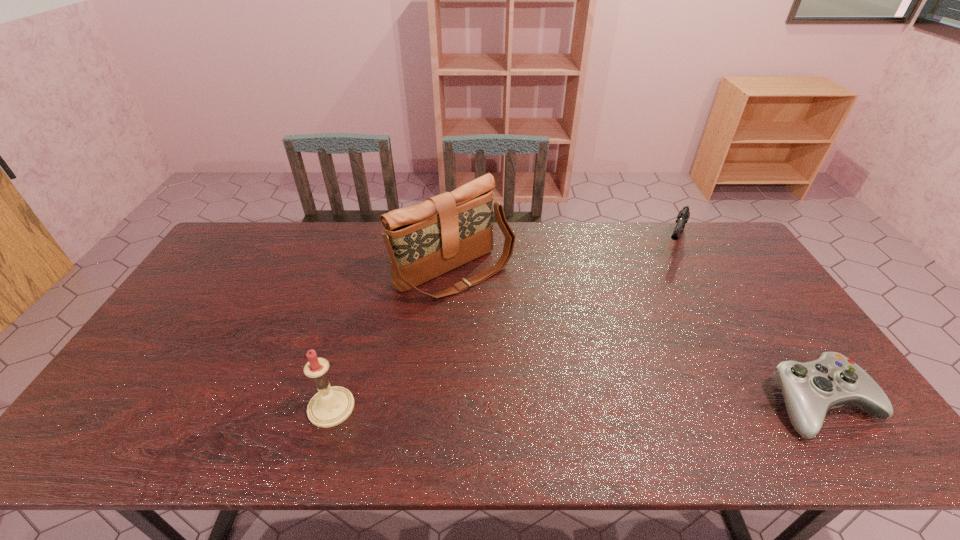
The height and width of the screenshot is (540, 960). Identify the location of free space on the desktop that is between the candle and the shortest object and is positioned on the front-facing side of the second object from left to right. (602, 406).

You are a GUI agent. You are given a task and a screenshot of the screen. Output one action in this format:
    pyautogui.click(x=<x>, y=<y>)
    Task: Click on the free spot on the desktop that is between the candle and the shortest object and is positioned at the end of the barrel of the gun
    The height and width of the screenshot is (540, 960).
    Given the screenshot: What is the action you would take?
    pyautogui.click(x=608, y=406)